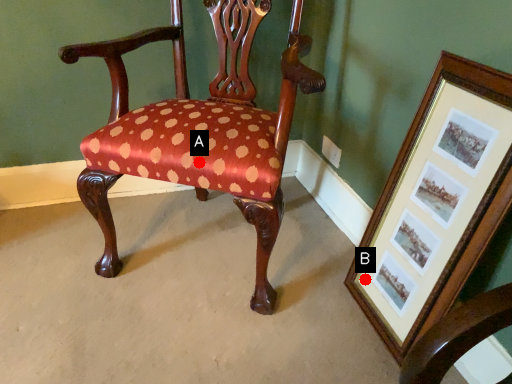
Question: Two points are circled on the image, labeled by A and B beside each circle. Which point appears closest to the camera in this image?

Choices:
 (A) A is closer
 (B) B is closer

Answer: (A)